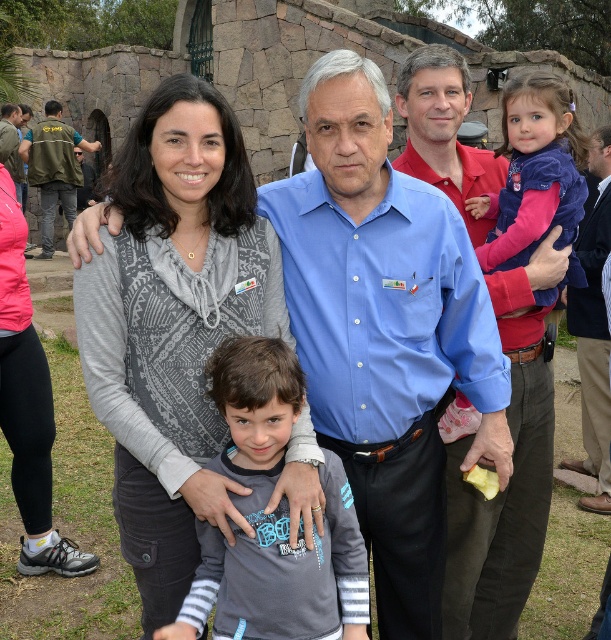
You are a photographer standing at the camera position. You want to adjust your zoom lens to focus on the gray textured vest at center. What is the approximate distance in meters you need to account for in your focus settings?

The gray textured vest at center is located 12.39 meters away from the camera, so the focus setting should be adjusted to approximately 12.4 meters.

You are a photographer trying to frame a shot of the gray textured vest at center and the green vest at left. Which vest will appear smaller in the photo?

The gray textured vest at center appears smaller because it occupies less space than the green vest at left.